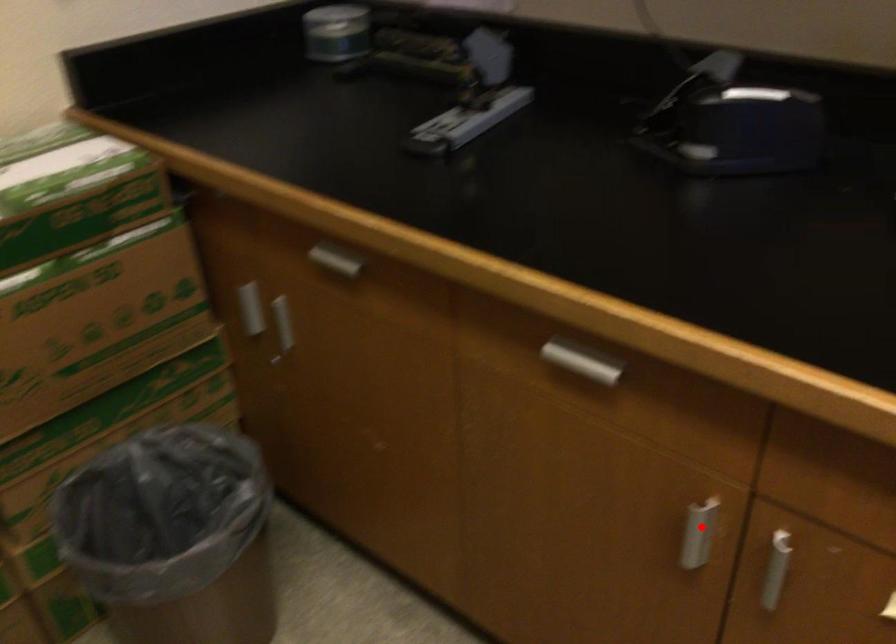
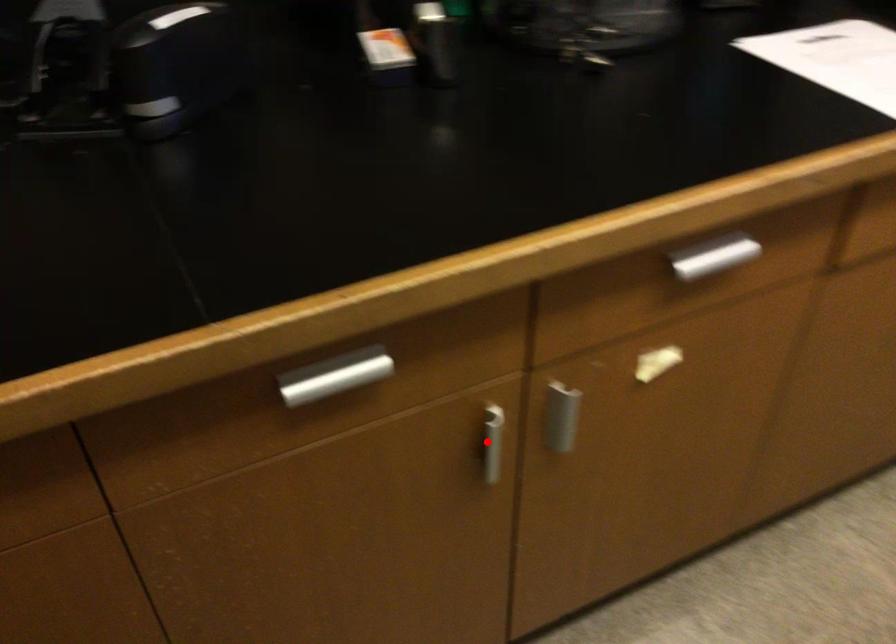
Based on the photo, I am providing you with two images of the same scene from different viewpoints. A red point is marked on the first image and another point is marked on the second image. Are the points marked in image1 and image2 representing the same 3D position?

Yes